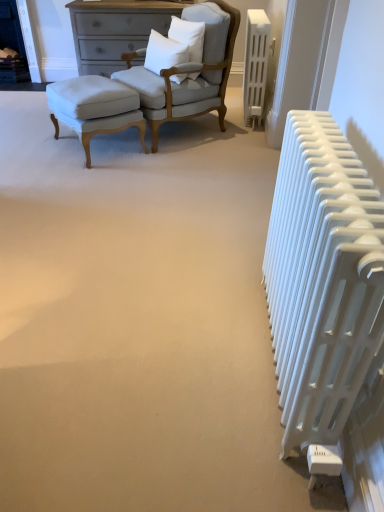
Question: Would you say white soft pillow at upper center, which is the second pillow from left to right, is inside or outside matte white fabric chair at upper left?

Choices:
 (A) inside
 (B) outside

Answer: (A)

Question: From a real-world perspective, is white soft pillow at upper center, which is the 1th pillow in right-to-left order, above or below matte white fabric chair at upper left?

Choices:
 (A) below
 (B) above

Answer: (B)

Question: Considering the real-world distances, which object is farthest from the white soft pillow at upper center, which is the second pillow from left to right?

Choices:
 (A) white plastic radiator at right, which is the second radiator from top to bottom
 (B) white soft pillow at center, which is the second pillow from right to left
 (C) white plastic radiator at upper right, the 2th radiator when ordered from front to back
 (D) light beige fabric stool at center-left
 (E) matte white fabric chair at upper left

Answer: (A)

Question: Based on their relative distances, which object is farther from the white soft pillow at upper center, which is the second pillow from left to right?

Choices:
 (A) light beige fabric stool at center-left
 (B) white plastic radiator at right, which is the second radiator from top to bottom
 (C) matte white fabric chair at upper left
 (D) white plastic radiator at upper right, positioned as the first radiator in back-to-front order
 (E) white soft pillow at center, which is the first pillow from left to right

Answer: (B)